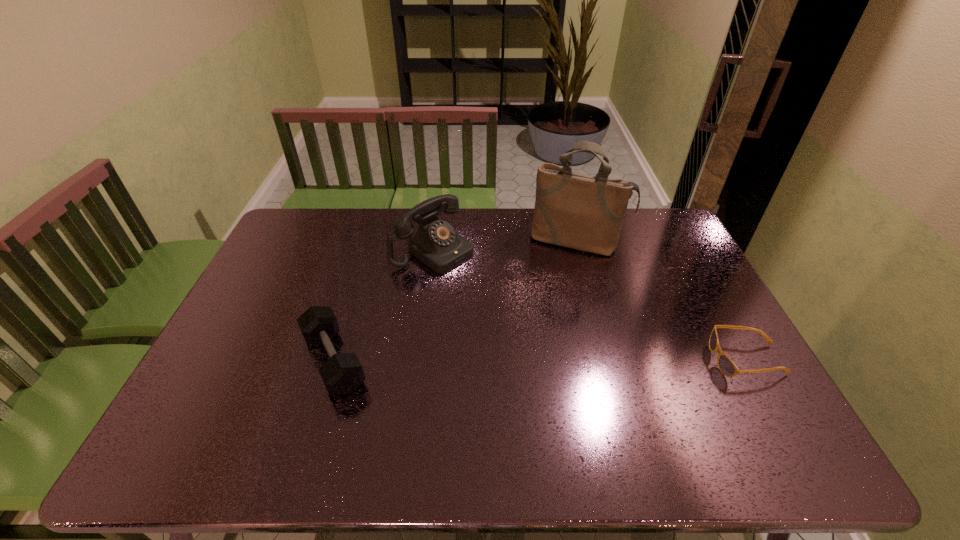
Find the location of a particular element. Image resolution: width=960 pixels, height=540 pixels. vacant area in the image that satisfies the following two spatial constraints: 1. on the back side of the second tallest object; 2. on the left side of the tallest object is located at coordinates pos(435,240).

Identify the location of free space that satisfies the following two spatial constraints: 1. on the back side of the dumbbell; 2. on the right side of the second tallest object. Image resolution: width=960 pixels, height=540 pixels. (368, 250).